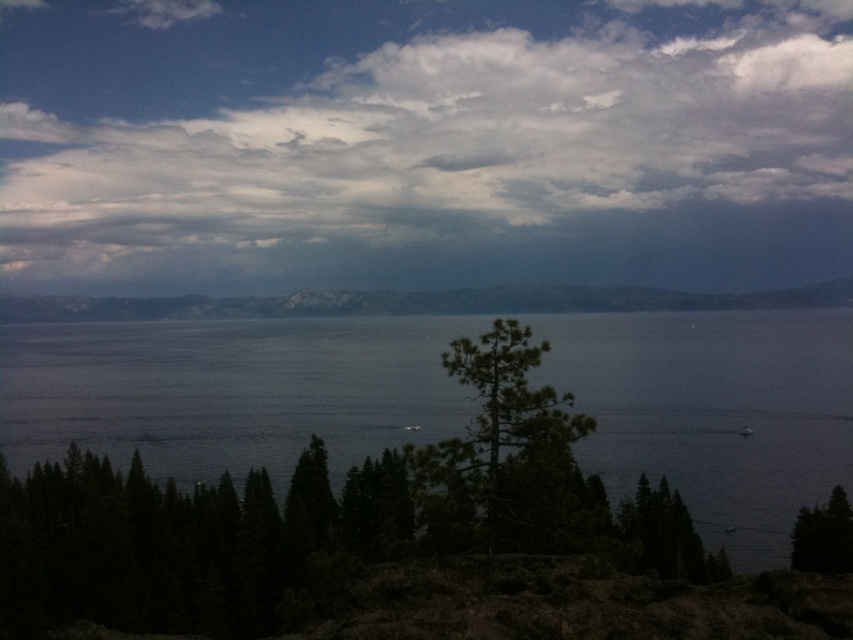
Question: Does green textured tree at center have a larger size compared to green matte tree at lower right?

Choices:
 (A) yes
 (B) no

Answer: (B)

Question: Which point is closer to the camera?

Choices:
 (A) green textured tree at center
 (B) cloudy sky at upper center
 (C) dark blue water at center

Answer: (A)

Question: Can you confirm if gray matte horizon at center is smaller than green matte tree at lower right?

Choices:
 (A) no
 (B) yes

Answer: (A)

Question: Can you confirm if cloudy sky at upper center is positioned to the left of dark blue water at center?

Choices:
 (A) yes
 (B) no

Answer: (A)

Question: Estimate the real-world distances between objects in this image. Which object is closer to the cloudy sky at upper center?

Choices:
 (A) gray matte horizon at center
 (B) green matte tree at lower right

Answer: (A)

Question: Which object is closer to the camera taking this photo?

Choices:
 (A) cloudy sky at upper center
 (B) green matte tree at lower right

Answer: (B)